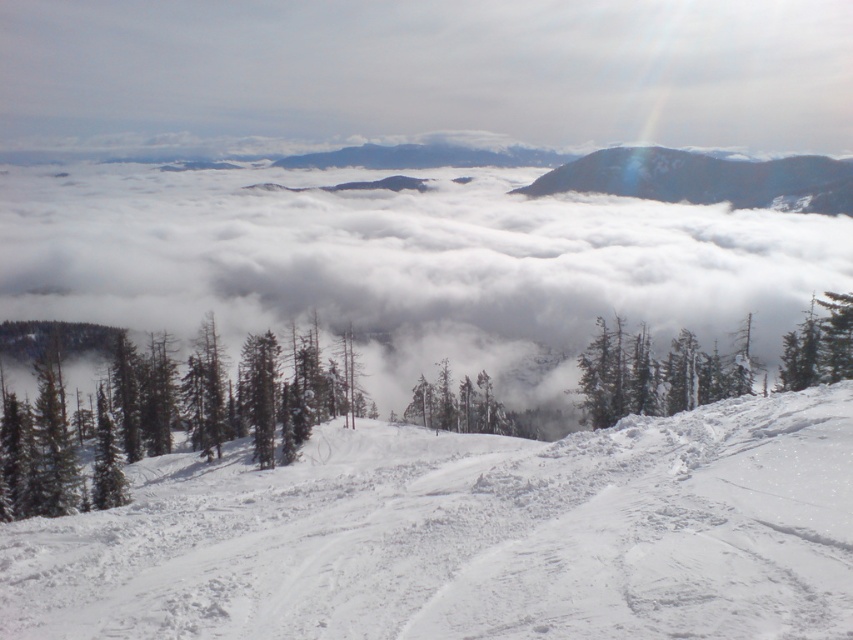
Question: Can you confirm if white snow ski slope at center is positioned below white fluffy cloud at center?

Choices:
 (A) yes
 (B) no

Answer: (A)

Question: Among these objects, which one is farthest from the camera?

Choices:
 (A) white snow ski slope at center
 (B) green matte tree at upper right
 (C) white fluffy cloud at center

Answer: (C)

Question: Which point appears farthest from the camera in this image?

Choices:
 (A) (782, 358)
 (B) (189, 282)

Answer: (B)

Question: Can you confirm if white snow ski slope at center is bigger than green matte tree at upper right?

Choices:
 (A) yes
 (B) no

Answer: (A)

Question: Does white snow ski slope at center lie in front of green matte tree at upper right?

Choices:
 (A) no
 (B) yes

Answer: (B)

Question: Which object appears closest to the camera in this image?

Choices:
 (A) white fluffy cloud at center
 (B) green matte tree at upper right

Answer: (B)